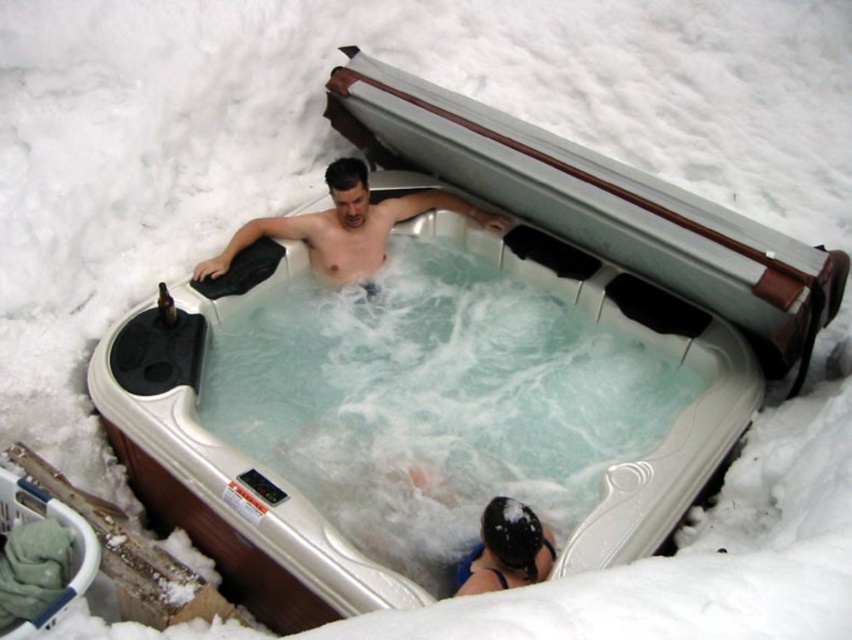
You are planning to place a small floating toy in the hot tub. Given the clear plastic water at center and the shiny silver tub at center, which one has a wider area to accommodate the toy?

The clear plastic water at center has a larger width than the shiny silver tub at center, so it provides a wider area to place the small floating toy.

You are standing in front of the hot tub and want to reach both points. Which point, point (x=417, y=572) or point (x=240, y=236), will you reach first?

Point (x=417, y=572) is closer to the camera than point (x=240, y=236), so you will reach point (x=417, y=572) first.

What is located at the coordinates point (435, 400) in the image?

At point (435, 400) lies clear plastic water at center.